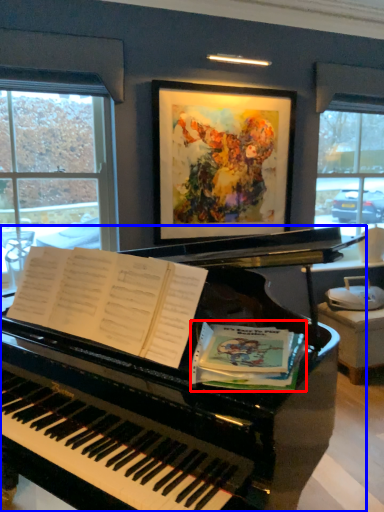
Question: Which object is further to the camera taking this photo, paperback book (highlighted by a red box) or piano (highlighted by a blue box)?

Choices:
 (A) paperback book
 (B) piano

Answer: (A)